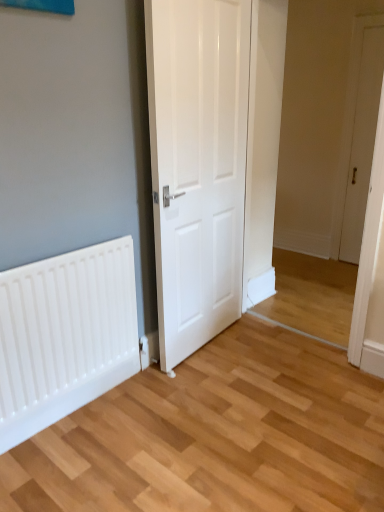
Question: Should I look upward or downward to see white wooden door at right, positioned as the first door in back-to-front order?

Choices:
 (A) up
 (B) down

Answer: (A)

Question: Is white wooden door at right, the 1th door viewed from the right, to the left of white glossy door at center, the 2th door in the back-to-front sequence, from the viewer's perspective?

Choices:
 (A) no
 (B) yes

Answer: (A)

Question: Is white wooden door at right, which ranks as the second door in left-to-right order, wider than white glossy door at center, the 1th door positioned from the left?

Choices:
 (A) yes
 (B) no

Answer: (B)

Question: Can you confirm if white wooden door at right, the 1th door viewed from the right, is positioned to the right of white glossy door at center, the 2th door in the back-to-front sequence?

Choices:
 (A) yes
 (B) no

Answer: (A)

Question: Is white wooden door at right, positioned as the first door in back-to-front order, directly adjacent to white glossy door at center, the 2th door in the back-to-front sequence?

Choices:
 (A) yes
 (B) no

Answer: (B)

Question: From the image's perspective, is white wooden door at right, the 1th door viewed from the right, below white glossy door at center, the 1th door positioned from the left?

Choices:
 (A) yes
 (B) no

Answer: (B)

Question: Does white wooden door at right, the 1th door viewed from the right, have a smaller size compared to white glossy door at center, the second door positioned from the right?

Choices:
 (A) no
 (B) yes

Answer: (B)

Question: Does white matte radiator at lower left have a lesser width compared to white glossy door at center, positioned as the first door in front-to-back order?

Choices:
 (A) yes
 (B) no

Answer: (A)

Question: Is white matte radiator at lower left positioned in front of white glossy door at center, the second door positioned from the right?

Choices:
 (A) no
 (B) yes

Answer: (A)

Question: Could you tell me if white matte radiator at lower left is facing white glossy door at center, the 2th door in the back-to-front sequence?

Choices:
 (A) no
 (B) yes

Answer: (A)

Question: Is white matte radiator at lower left not inside white glossy door at center, the second door positioned from the right?

Choices:
 (A) yes
 (B) no

Answer: (A)

Question: Considering the relative sizes of white matte radiator at lower left and white glossy door at center, the 2th door in the back-to-front sequence, in the image provided, is white matte radiator at lower left smaller than white glossy door at center, the 2th door in the back-to-front sequence,?

Choices:
 (A) yes
 (B) no

Answer: (A)

Question: Is white matte radiator at lower left to the left of white glossy door at center, the second door positioned from the right, from the viewer's perspective?

Choices:
 (A) no
 (B) yes

Answer: (B)

Question: Does white glossy door at center, the 1th door positioned from the left, lie behind white matte radiator at lower left?

Choices:
 (A) no
 (B) yes

Answer: (A)